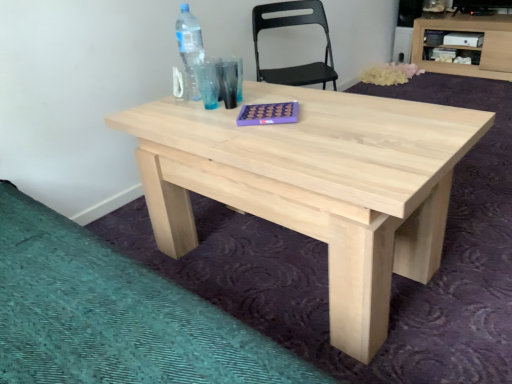
Question: From a real-world perspective, is black plastic chair at upper center physically located above or below light wood/unfinished wood computer desk at upper right?

Choices:
 (A) below
 (B) above

Answer: (B)

Question: Which is correct: black plastic chair at upper center is inside light wood/unfinished wood computer desk at upper right, or outside of it?

Choices:
 (A) inside
 (B) outside

Answer: (B)

Question: Considering the real-world distances, which object is closest to the black plastic chair at upper center?

Choices:
 (A) transparent plastic bottle at upper left
 (B) natural wood table at center
 (C) light wood/unfinished wood computer desk at upper right

Answer: (A)

Question: Which object is the closest to the black plastic chair at upper center?

Choices:
 (A) transparent plastic bottle at upper left
 (B) light wood/unfinished wood computer desk at upper right
 (C) natural wood table at center

Answer: (A)